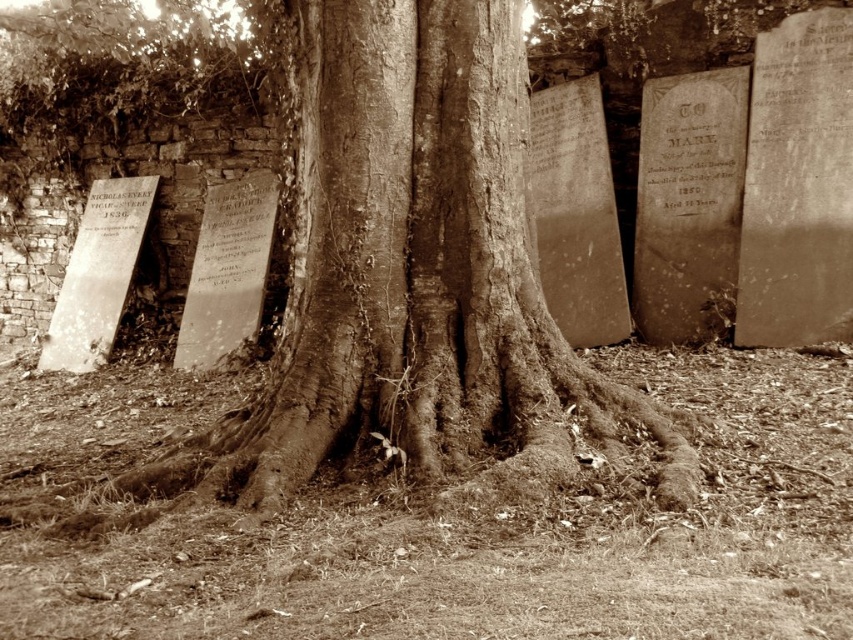
Question: Among these objects, which one is farthest from the camera?

Choices:
 (A) smooth stone inscription at center right
 (B) smooth bark tree at center

Answer: (A)

Question: Does smooth stone inscription at center right lie in front of smooth stone plaque at center?

Choices:
 (A) no
 (B) yes

Answer: (B)

Question: Which is farther from the smooth bark tree at center?

Choices:
 (A) smooth stone plaque at center
 (B) smooth stone inscription at center right

Answer: (A)

Question: Considering the relative positions of smooth bark tree at center and smooth stone plaque at center in the image provided, where is smooth bark tree at center located with respect to smooth stone plaque at center?

Choices:
 (A) below
 (B) above

Answer: (A)

Question: Which of the following is the farthest from the observer?

Choices:
 (A) (347, 410)
 (B) (718, 113)

Answer: (B)

Question: Is smooth bark tree at center below smooth stone inscription at center right?

Choices:
 (A) yes
 (B) no

Answer: (A)